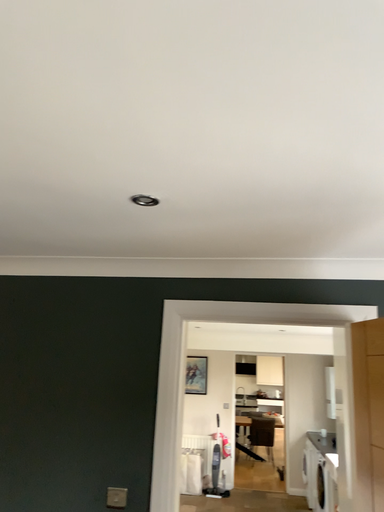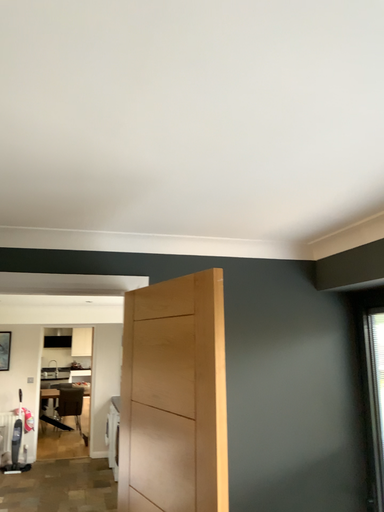
Question: How did the camera likely rotate when shooting the video?

Choices:
 (A) rotated right
 (B) rotated left

Answer: (A)